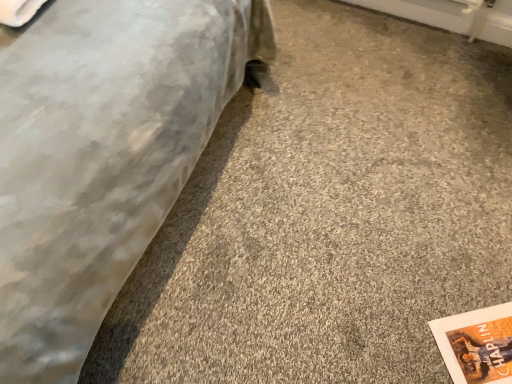
Find the location of a particular element. Image resolution: width=512 pixels, height=384 pixels. vacant region to the left of orange paper book at lower right is located at coordinates (397, 321).